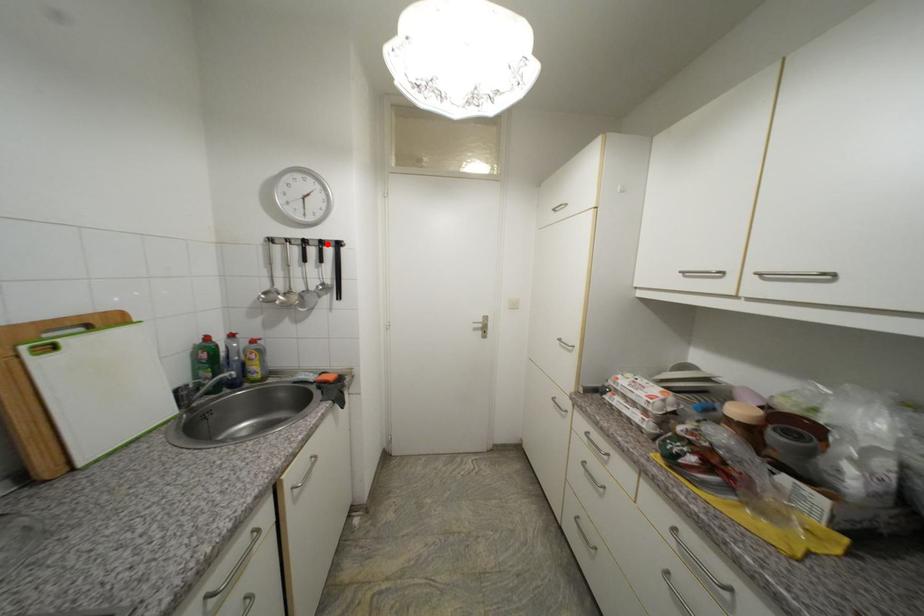
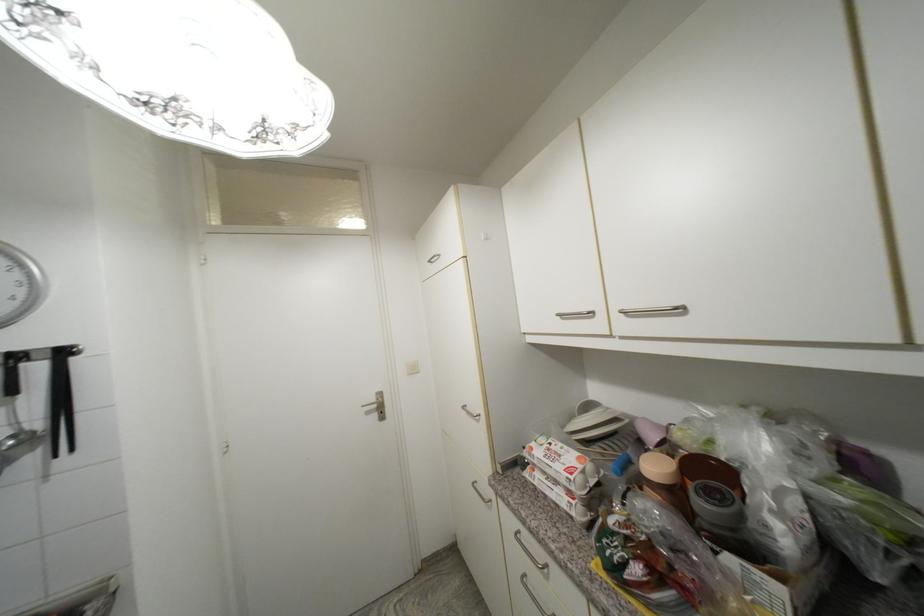
The point at the highlighted location is marked in the first image. Where is the corresponding point in the second image?

(22, 359)